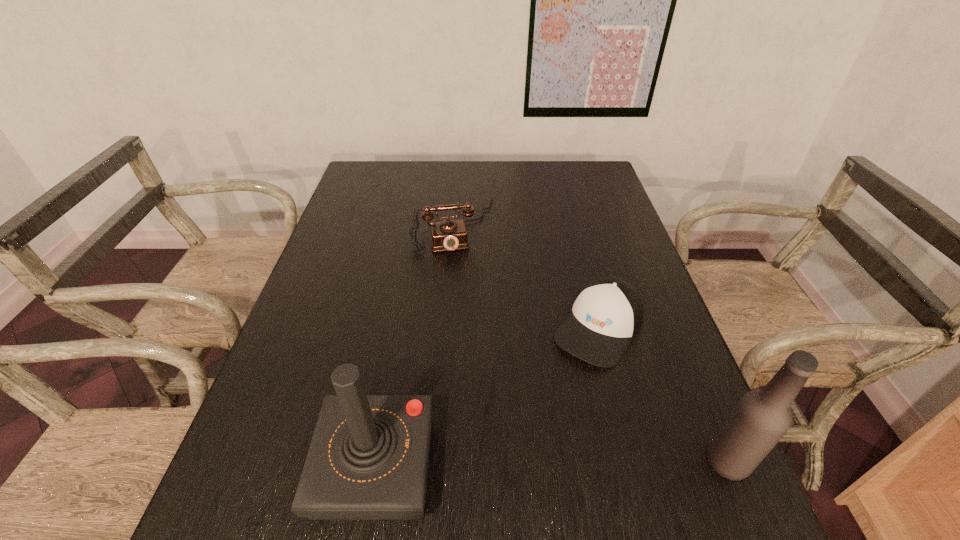
Find the location of a particular element. Image resolution: width=960 pixels, height=540 pixels. free region at the far edge of the desktop is located at coordinates (460, 194).

Where is `vacant region at the near edge of the desktop`? The height and width of the screenshot is (540, 960). vacant region at the near edge of the desktop is located at coordinates (546, 447).

The width and height of the screenshot is (960, 540). I want to click on vacant area at the left edge of the desktop, so click(272, 394).

In the image, there is a desktop. Where is `vacant space at the right edge`? This screenshot has width=960, height=540. vacant space at the right edge is located at coordinates (x=654, y=360).

You are a GUI agent. You are given a task and a screenshot of the screen. Output one action in this format:
    pyautogui.click(x=<x>, y=<y>)
    Task: Click on the vacant space at the far left corner
    The height and width of the screenshot is (540, 960).
    Given the screenshot: What is the action you would take?
    pyautogui.click(x=373, y=166)

Where is `free space at the near left corner`? This screenshot has width=960, height=540. free space at the near left corner is located at coordinates (294, 481).

In the image, there is a desktop. At what (x,y) coordinates should I click in order to perform the action: click on blank space at the near right corner. Please return your answer as a coordinate pair (x, y). Looking at the image, I should click on (686, 488).

At what (x,y) coordinates should I click in order to perform the action: click on vacant space in between the joystick and the telephone. Please return your answer as a coordinate pair (x, y). The height and width of the screenshot is (540, 960). Looking at the image, I should click on (415, 346).

This screenshot has width=960, height=540. What are the coordinates of `empty location between the cap and the farthest object` in the screenshot? It's located at (526, 277).

Identify the location of free spot between the joystick and the shortest object. (487, 397).